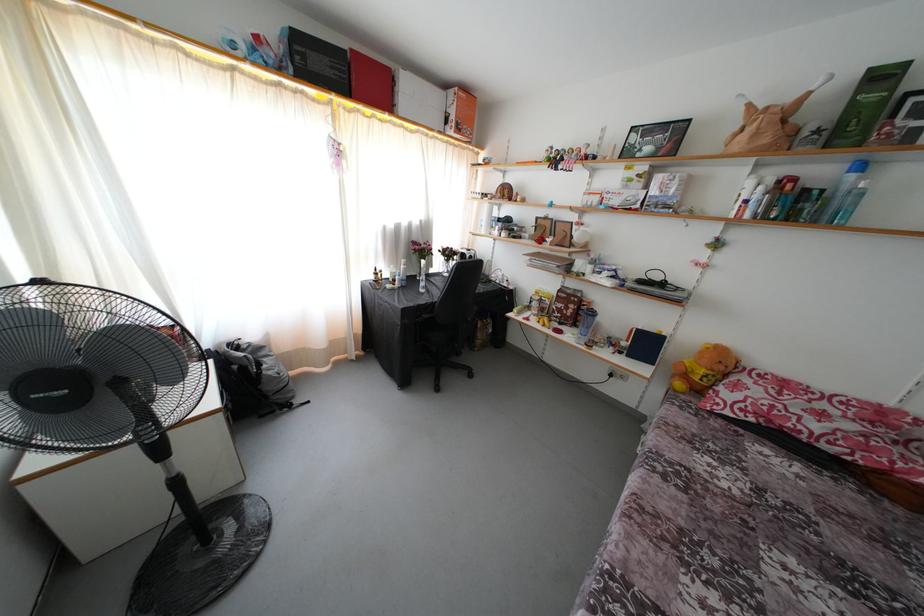
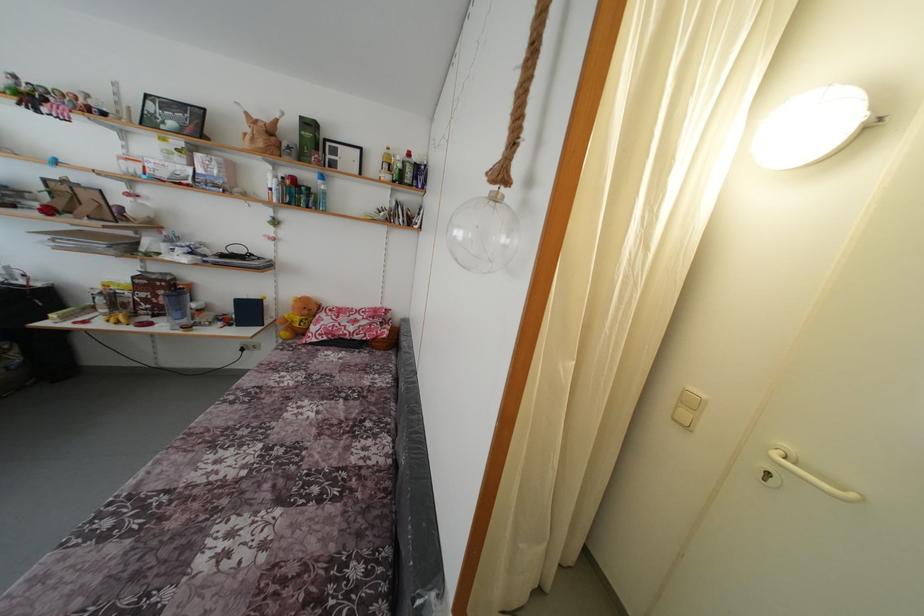
The point at (760, 389) is marked in the first image. Where is the corresponding point in the second image?

(332, 321)